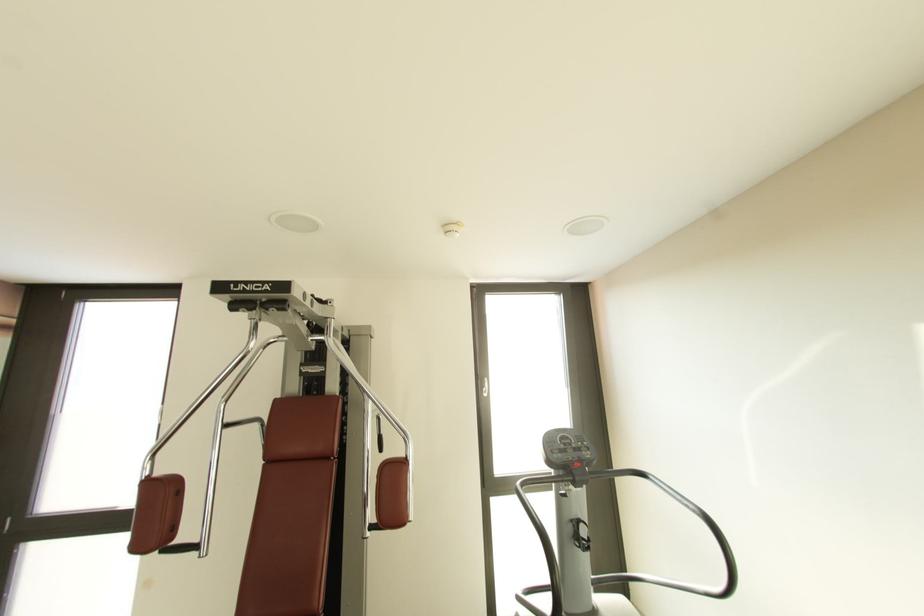
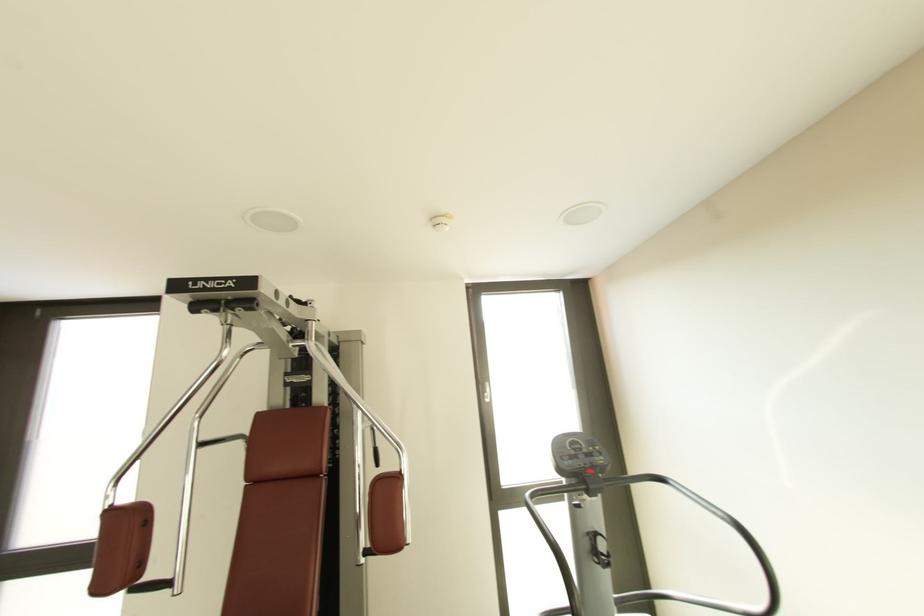
Question: What movement of the cameraman would produce the second image?

Choices:
 (A) Left
 (B) Right
 (C) Forward
 (D) Backward

Answer: (C)